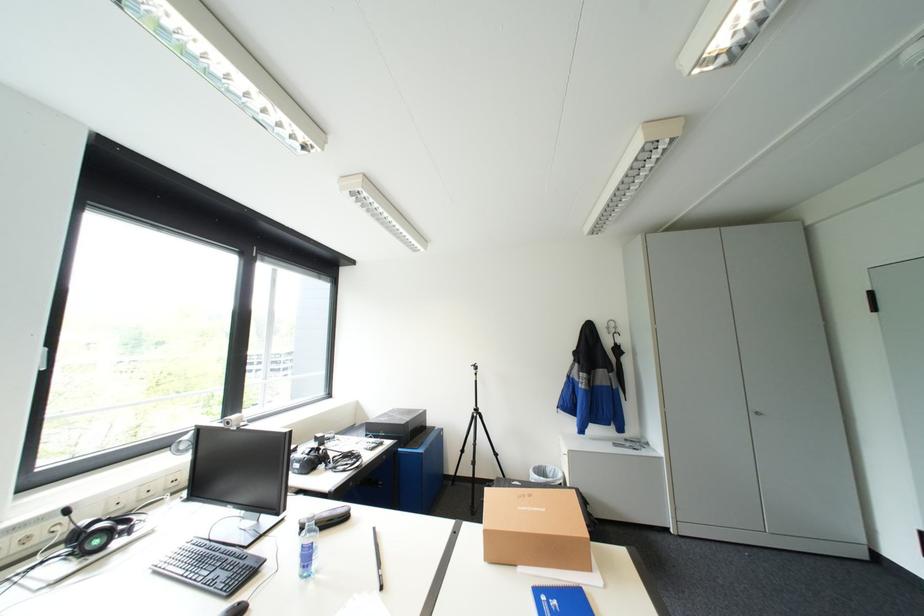
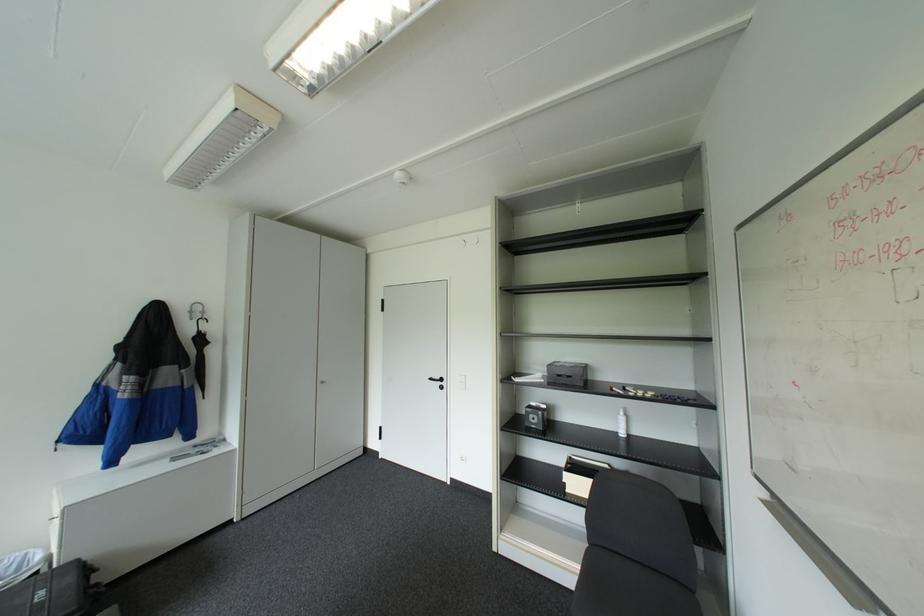
Locate, in the second image, the point that corresponds to point 617,331 in the first image.

(200, 318)